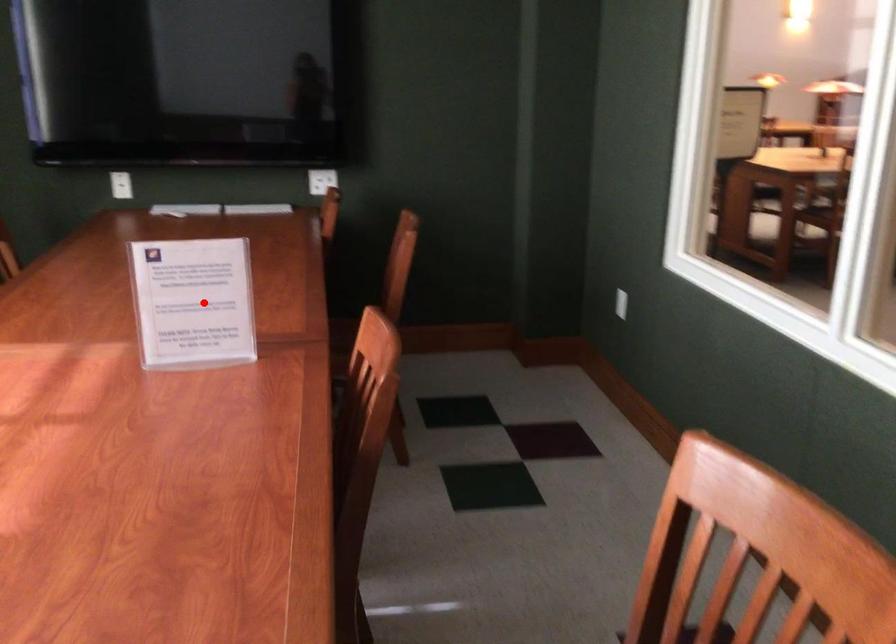
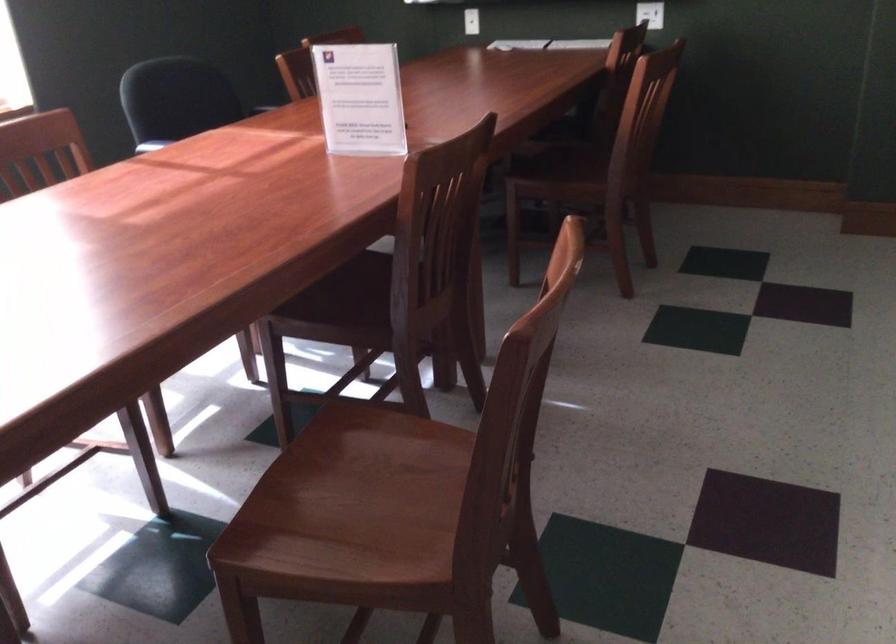
Where in the second image is the point corresponding to the highlighted location from the first image?

(359, 98)